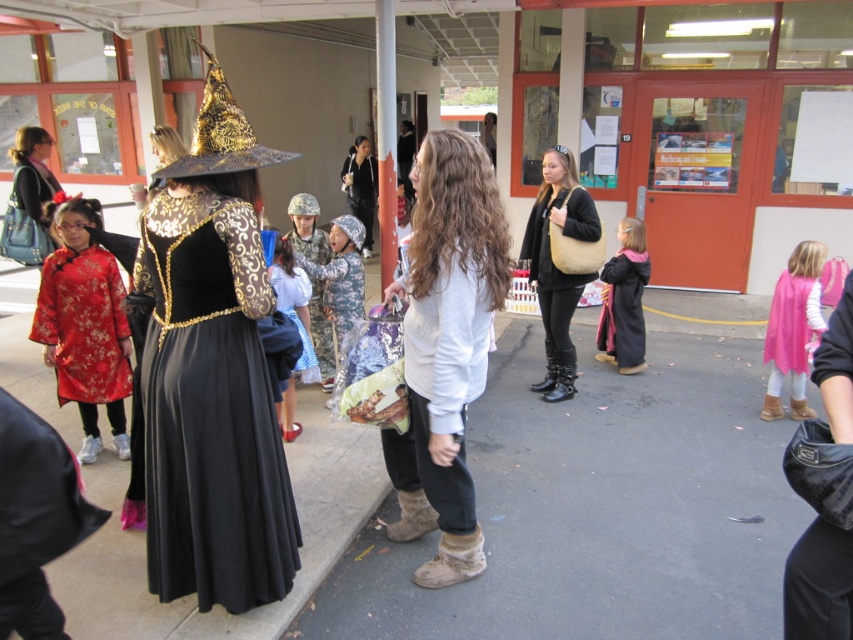
Question: Can you confirm if pink satin cape at right is positioned above pink fuzzy coat at center?

Choices:
 (A) no
 (B) yes

Answer: (A)

Question: Among these objects, which one is nearest to the camera?

Choices:
 (A) matte black jacket at center
 (B) pink fuzzy coat at center
 (C) pink satin cape at right

Answer: (C)

Question: Estimate the real-world distances between objects in this image. Which object is closer to the velvet/golden/black dress at center?

Choices:
 (A) pink fuzzy coat at center
 (B) white soft sweater at center
 (C) camouflage fabric robe at center

Answer: (B)

Question: Can you confirm if pink fuzzy coat at center is positioned to the left of black leather jacket at center?

Choices:
 (A) no
 (B) yes

Answer: (A)

Question: Which object is closer to the camera taking this photo?

Choices:
 (A) black leather jacket at center
 (B) pink satin cape at right

Answer: (B)

Question: Is matte black jacket at center below pink satin cape at right?

Choices:
 (A) no
 (B) yes

Answer: (A)